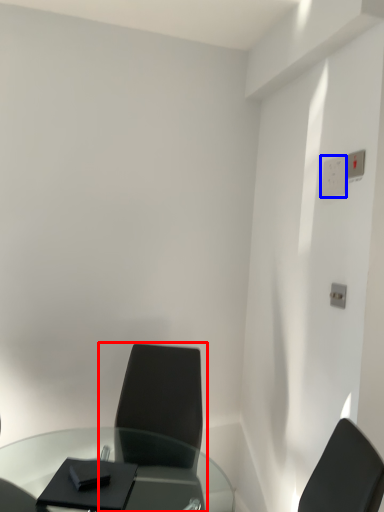
Question: Among these objects, which one is nearest to the camera, chair (highlighted by a red box) or electric outlet (highlighted by a blue box)?

Choices:
 (A) chair
 (B) electric outlet

Answer: (A)